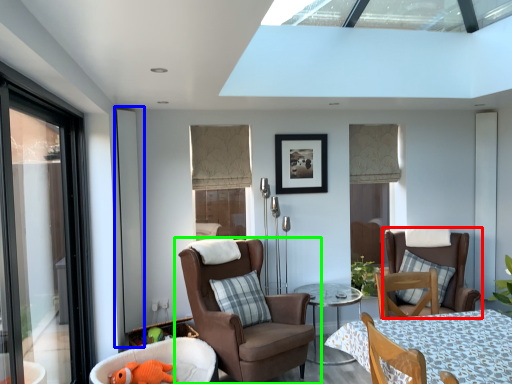
Question: Which object is the farthest from chair (highlighted by a red box)? Choose among these: screen door (highlighted by a blue box) or chair (highlighted by a green box).

Choices:
 (A) screen door
 (B) chair

Answer: (A)